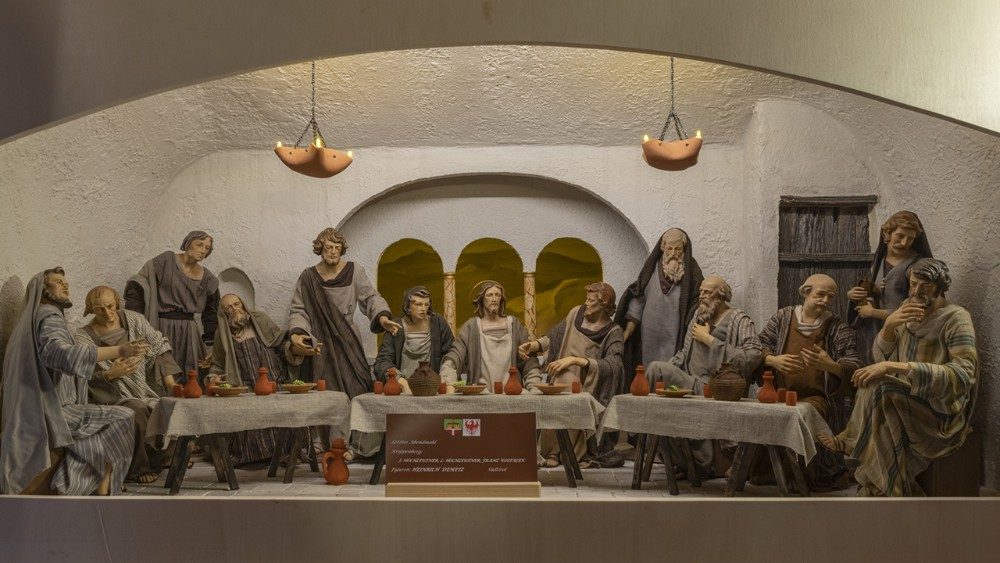
Find the location of a particular element. pitcher is located at coordinates (189, 382), (262, 382), (336, 458), (394, 378), (511, 383), (421, 379), (636, 384), (770, 392), (725, 391).